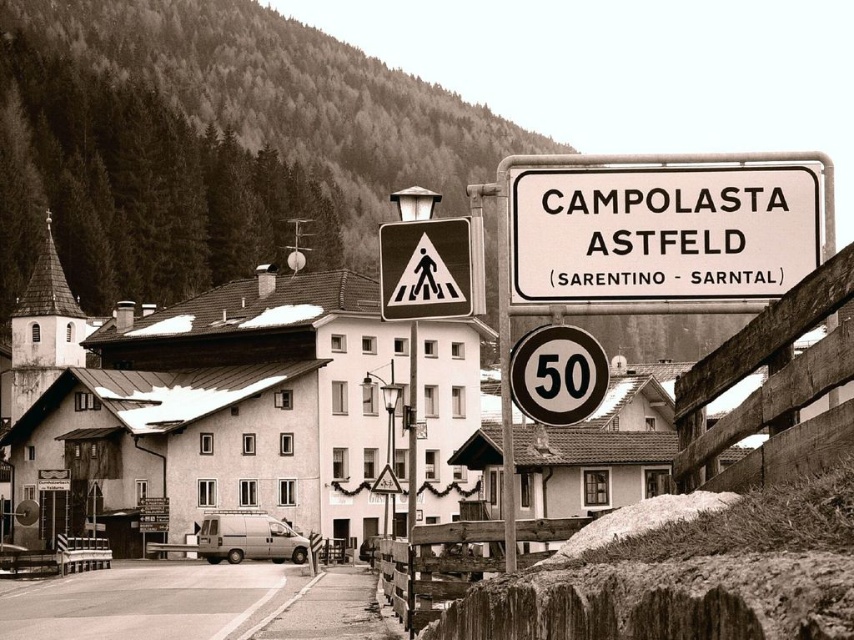
You are driving a car that is 15 feet long and want to stop completely before reaching the metal pedestrian crossing sign at center. If you start braking from a point 70 feet away from the sign, will you be able to stop in time?

The distance between the metal pedestrian crossing sign at center and the camera is 68.25 feet. Since you start braking from 70 feet away, which is slightly farther than the actual distance to the sign, you will not reach the sign before stopping. Therefore, you should be able to stop safely before the metal pedestrian crossing sign at center.

You are a photographer standing in front of the white matte building at center and the metallic circular speed limit sign at center. You want to take a photo that includes both objects in the frame. Which object should you position closer to the edge of the frame to ensure the other is more prominent?

The metallic circular speed limit sign at center is shorter than the white matte building at center. To make the building more prominent, position the metallic circular speed limit sign at center closer to the edge of the frame.